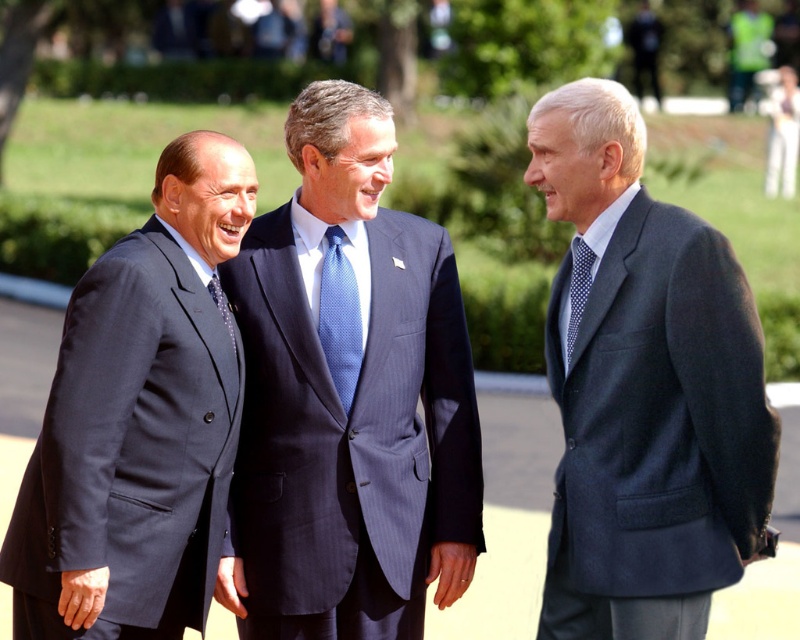
Based on the photo, you are a photographer trying to capture a clear photo of the blue pinstripe suit at center and the blue dotted tie at center. Since the camera can only focus on one object at a time, which object should you choose to ensure the larger one is in focus?

The blue pinstripe suit at center is larger in size than the blue dotted tie at center, so you should focus on the blue pinstripe suit at center to ensure the larger object is in focus.